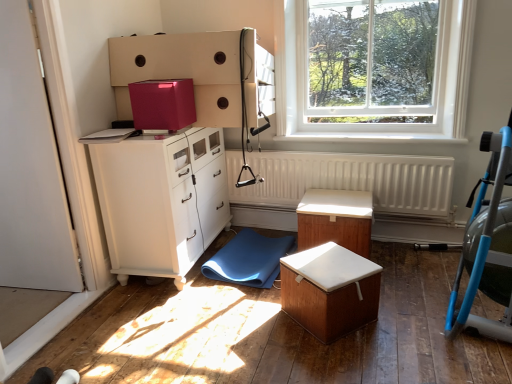
I want to click on free space in front of wooden box with white cushion at center, marked as the first table in a front-to-back arrangement, so click(342, 361).